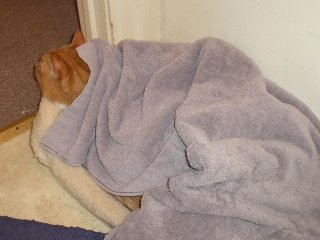
Where is `bed`? Image resolution: width=320 pixels, height=240 pixels. bed is located at coordinates (80, 175).